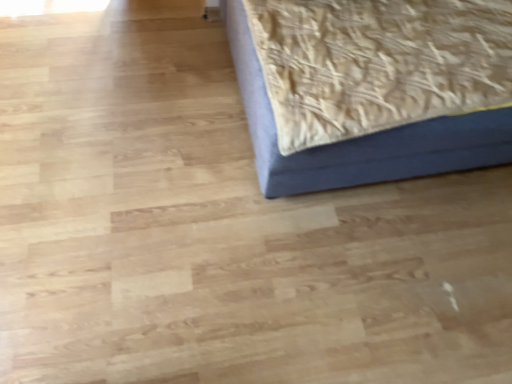
What do you see at coordinates (359, 137) in the screenshot? I see `velvet blue bed at upper right` at bounding box center [359, 137].

Image resolution: width=512 pixels, height=384 pixels. Find the location of `velvet blue bed at upper right`. velvet blue bed at upper right is located at coordinates (359, 137).

The width and height of the screenshot is (512, 384). I want to click on velvet blue bed at upper right, so click(359, 137).